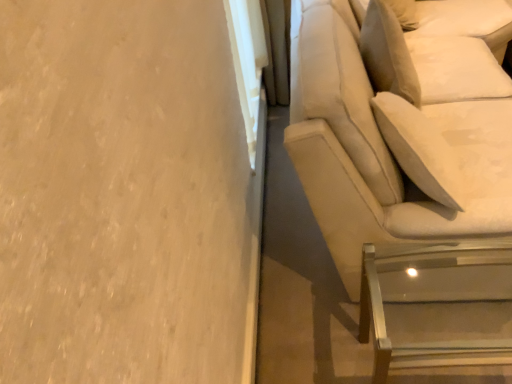
Question: Does beige fabric studio couch at right come behind clear glass table at lower right?

Choices:
 (A) yes
 (B) no

Answer: (B)

Question: From the image's perspective, is beige fabric studio couch at right above clear glass table at lower right?

Choices:
 (A) no
 (B) yes

Answer: (B)

Question: Is beige fabric studio couch at right wider than clear glass table at lower right?

Choices:
 (A) yes
 (B) no

Answer: (A)

Question: Is beige fabric studio couch at right positioned with its back to clear glass table at lower right?

Choices:
 (A) no
 (B) yes

Answer: (A)

Question: From the image's perspective, is beige fabric studio couch at right under clear glass table at lower right?

Choices:
 (A) no
 (B) yes

Answer: (A)

Question: Does beige fabric studio couch at right have a lesser height compared to clear glass table at lower right?

Choices:
 (A) no
 (B) yes

Answer: (A)

Question: From the image's perspective, is clear glass table at lower right located beneath beige fabric studio couch at right?

Choices:
 (A) yes
 (B) no

Answer: (A)

Question: Does clear glass table at lower right come in front of beige fabric studio couch at right?

Choices:
 (A) no
 (B) yes

Answer: (A)

Question: From a real-world perspective, does clear glass table at lower right sit lower than beige fabric studio couch at right?

Choices:
 (A) yes
 (B) no

Answer: (A)

Question: Is the surface of clear glass table at lower right in direct contact with beige fabric studio couch at right?

Choices:
 (A) yes
 (B) no

Answer: (B)

Question: Can you confirm if clear glass table at lower right is bigger than beige fabric studio couch at right?

Choices:
 (A) no
 (B) yes

Answer: (A)

Question: Is clear glass table at lower right turned away from beige fabric studio couch at right?

Choices:
 (A) yes
 (B) no

Answer: (B)

Question: From the image's perspective, relative to clear glass table at lower right, is beige fabric studio couch at right above or below?

Choices:
 (A) below
 (B) above

Answer: (B)